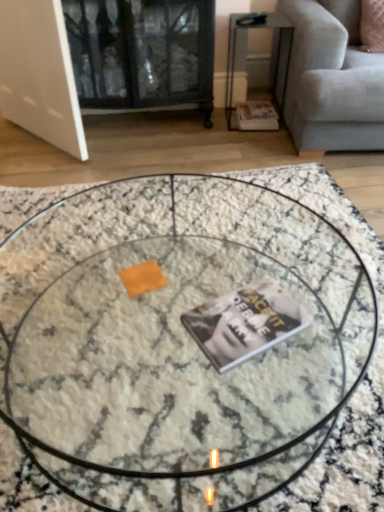
Question: Does metallic silver side table at upper right lie in front of marble textured coffee table at center?

Choices:
 (A) yes
 (B) no

Answer: (B)

Question: Considering the relative sizes of metallic silver side table at upper right and marble textured coffee table at center in the image provided, is metallic silver side table at upper right taller than marble textured coffee table at center?

Choices:
 (A) yes
 (B) no

Answer: (A)

Question: Does metallic silver side table at upper right have a smaller size compared to marble textured coffee table at center?

Choices:
 (A) yes
 (B) no

Answer: (A)

Question: Is marble textured coffee table at center at the back of metallic silver side table at upper right?

Choices:
 (A) no
 (B) yes

Answer: (A)

Question: Is metallic silver side table at upper right not close to marble textured coffee table at center?

Choices:
 (A) yes
 (B) no

Answer: (A)

Question: Visually, is metallic silver side table at upper right positioned to the left or to the right of matte paper magazine at lower right, which appears as the 1th magazine when viewed from the back?

Choices:
 (A) right
 (B) left

Answer: (B)

Question: From a real-world perspective, is metallic silver side table at upper right positioned above or below matte paper magazine at lower right, the 2th magazine from the left?

Choices:
 (A) below
 (B) above

Answer: (B)

Question: Is metallic silver side table at upper right taller or shorter than matte paper magazine at lower right, which appears as the 1th magazine when viewed from the back?

Choices:
 (A) short
 (B) tall

Answer: (B)

Question: Is metallic silver side table at upper right spatially inside matte paper magazine at lower right, marked as the 2th magazine in a front-to-back arrangement, or outside of it?

Choices:
 (A) outside
 (B) inside

Answer: (A)

Question: From a real-world perspective, is light gray fabric couch at upper right positioned above or below matte paper magazine at lower right, marked as the 2th magazine in a front-to-back arrangement?

Choices:
 (A) below
 (B) above

Answer: (B)

Question: Is light gray fabric couch at upper right taller or shorter than matte paper magazine at lower right, marked as the 2th magazine in a front-to-back arrangement?

Choices:
 (A) tall
 (B) short

Answer: (A)

Question: Does point (350, 16) appear closer or farther from the camera than point (248, 108)?

Choices:
 (A) farther
 (B) closer

Answer: (B)

Question: Based on their positions, is light gray fabric couch at upper right located to the left or right of matte paper magazine at lower right, which appears as the 1th magazine when viewed from the back?

Choices:
 (A) left
 (B) right

Answer: (B)

Question: Visually, is marble textured coffee table at center positioned to the left or to the right of metallic silver side table at upper right?

Choices:
 (A) right
 (B) left

Answer: (B)

Question: From the image's perspective, is marble textured coffee table at center positioned above or below metallic silver side table at upper right?

Choices:
 (A) below
 (B) above

Answer: (A)